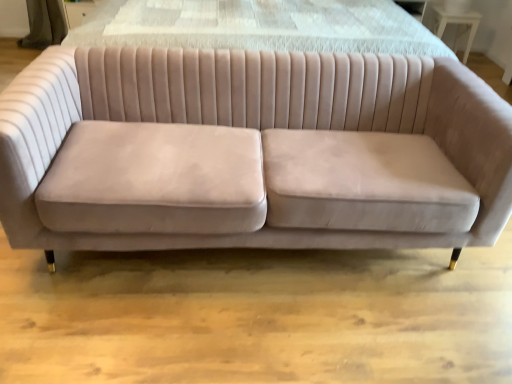
This screenshot has height=384, width=512. What do you see at coordinates (259, 128) in the screenshot? I see `velvet beige couch at center` at bounding box center [259, 128].

Find the location of `velvet beige couch at center`. velvet beige couch at center is located at coordinates [x=259, y=128].

Image resolution: width=512 pixels, height=384 pixels. What do you see at coordinates (457, 26) in the screenshot?
I see `white glossy table at upper right` at bounding box center [457, 26].

At what (x,y) coordinates should I click in order to perform the action: click on white glossy table at upper right. Please return your answer as a coordinate pair (x, y). Looking at the image, I should click on (457, 26).

This screenshot has height=384, width=512. I want to click on velvet beige couch at center, so click(259, 128).

Would you say white glossy table at upper right is to the left or to the right of velvet beige couch at center in the picture?

In the image, white glossy table at upper right appears on the right side of velvet beige couch at center.

Based on the photo, is white glossy table at upper right further to the viewer compared to velvet beige couch at center?

That is True.

Which is in front, point (467, 54) or point (289, 97)?

The point (289, 97) is in front.

From the image's perspective, relative to velvet beige couch at center, is white glossy table at upper right above or below?

Clearly, from the image's perspective, white glossy table at upper right is above velvet beige couch at center.

From a real-world perspective, is white glossy table at upper right above or below velvet beige couch at center?

Clearly, from a real-world perspective, white glossy table at upper right is below velvet beige couch at center.

Considering the relative sizes of white glossy table at upper right and velvet beige couch at center in the image provided, is white glossy table at upper right wider than velvet beige couch at center?

In fact, white glossy table at upper right might be narrower than velvet beige couch at center.

In terms of height, does white glossy table at upper right look taller or shorter compared to velvet beige couch at center?

Considering their sizes, white glossy table at upper right has less height than velvet beige couch at center.

Between white glossy table at upper right and velvet beige couch at center, which one has larger size?

Bigger between the two is velvet beige couch at center.

Is white glossy table at upper right spatially inside velvet beige couch at center, or outside of it?

white glossy table at upper right is not enclosed by velvet beige couch at center.

Would you say white glossy table at upper right is a long distance from velvet beige couch at center?

Yes, white glossy table at upper right is far from velvet beige couch at center.

Could you tell me if white glossy table at upper right is turned towards velvet beige couch at center?

No.

What's the angular difference between white glossy table at upper right and velvet beige couch at center's facing directions?

They differ by 2.57 degrees in their facing directions.

Where is `studio couch in front of the white glossy table at upper right`? Image resolution: width=512 pixels, height=384 pixels. studio couch in front of the white glossy table at upper right is located at coordinates (259, 128).

Considering the positions of objects velvet beige couch at center and white glossy table at upper right in the image provided, who is more to the left, velvet beige couch at center or white glossy table at upper right?

Positioned to the left is velvet beige couch at center.

Is velvet beige couch at center in front of white glossy table at upper right?

Yes, velvet beige couch at center is closer to the viewer.

Considering the points (219, 68) and (471, 37), which point is in front, point (219, 68) or point (471, 37)?

Point (219, 68)

From the image's perspective, is velvet beige couch at center under white glossy table at upper right?

Correct, velvet beige couch at center appears lower than white glossy table at upper right in the image.

From a real-world perspective, which is physically below, velvet beige couch at center or white glossy table at upper right?

In real-world perspective, white glossy table at upper right is lower.

In terms of width, does velvet beige couch at center look wider or thinner when compared to white glossy table at upper right?

Clearly, velvet beige couch at center has more width compared to white glossy table at upper right.

Does velvet beige couch at center have a lesser height compared to white glossy table at upper right?

Incorrect, the height of velvet beige couch at center does not fall short of that of white glossy table at upper right.

Who is smaller, velvet beige couch at center or white glossy table at upper right?

Smaller between the two is white glossy table at upper right.

Is velvet beige couch at center located outside white glossy table at upper right?

Yes, velvet beige couch at center is not within white glossy table at upper right.

Is velvet beige couch at center placed right next to white glossy table at upper right?

No, velvet beige couch at center is not in contact with white glossy table at upper right.

In the scene shown: Is velvet beige couch at center facing away from white glossy table at upper right?

Yes, velvet beige couch at center's orientation is away from white glossy table at upper right.

How many degrees apart are the facing directions of velvet beige couch at center and white glossy table at upper right?

There is a 2.57-degree angle between the facing directions of velvet beige couch at center and white glossy table at upper right.

Where is `studio couch that is on the left side of white glossy table at upper right`? studio couch that is on the left side of white glossy table at upper right is located at coordinates (259, 128).

Locate an element on the screen. The height and width of the screenshot is (384, 512). studio couch above the white glossy table at upper right (from a real-world perspective) is located at coordinates (259, 128).

The height and width of the screenshot is (384, 512). Find the location of `studio couch on the left of the white glossy table at upper right`. studio couch on the left of the white glossy table at upper right is located at coordinates (259, 128).